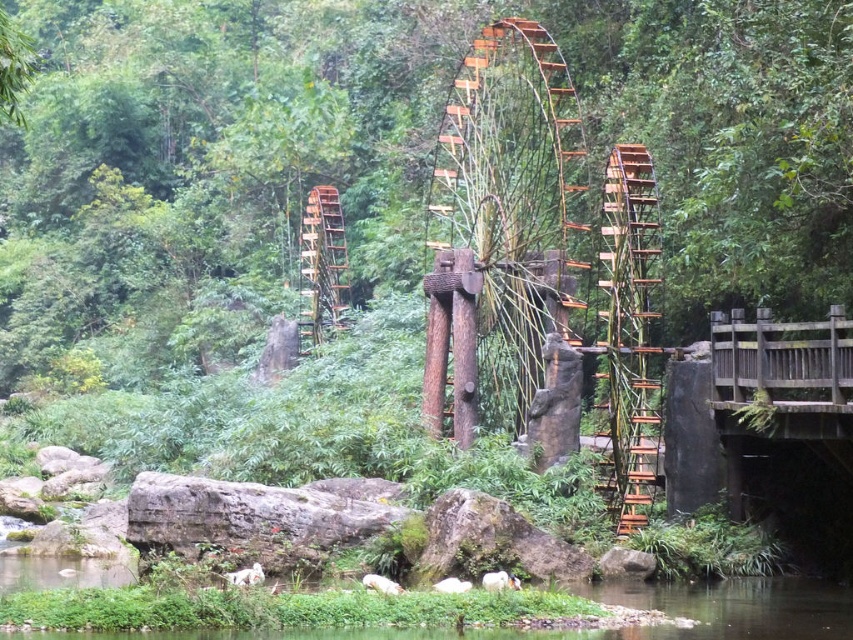
Question: Does wooden waterwheel at center appear on the left side of wooden bridge at right?

Choices:
 (A) no
 (B) yes

Answer: (B)

Question: Which point is farther to the camera?

Choices:
 (A) (329, 218)
 (B) (485, 348)

Answer: (A)

Question: Estimate the real-world distances between objects in this image. Which object is closer to the wooden waterwheel at center-right?

Choices:
 (A) rustic wood wheel at center
 (B) wooden waterwheel at center
 (C) wooden bridge at right

Answer: (B)

Question: Does wooden bridge at right come in front of rustic wood wheel at center?

Choices:
 (A) yes
 (B) no

Answer: (A)

Question: Which point appears farthest from the camera in this image?

Choices:
 (A) (323, 300)
 (B) (647, 458)
 (C) (440, 241)

Answer: (A)

Question: Is wooden waterwheel at center-right closer to camera compared to wooden bridge at right?

Choices:
 (A) yes
 (B) no

Answer: (B)